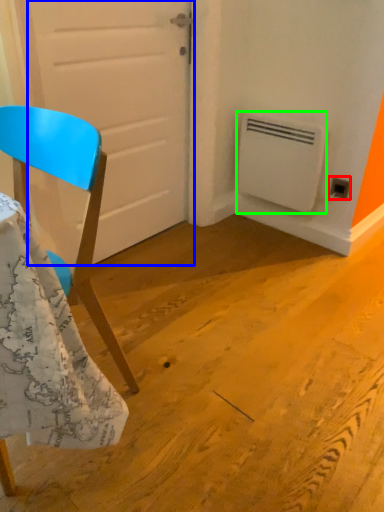
Question: Based on their relative distances, which object is nearer to electric outlet (highlighted by a red box)? Choose from door (highlighted by a blue box) and air conditioning (highlighted by a green box).

Choices:
 (A) door
 (B) air conditioning

Answer: (B)